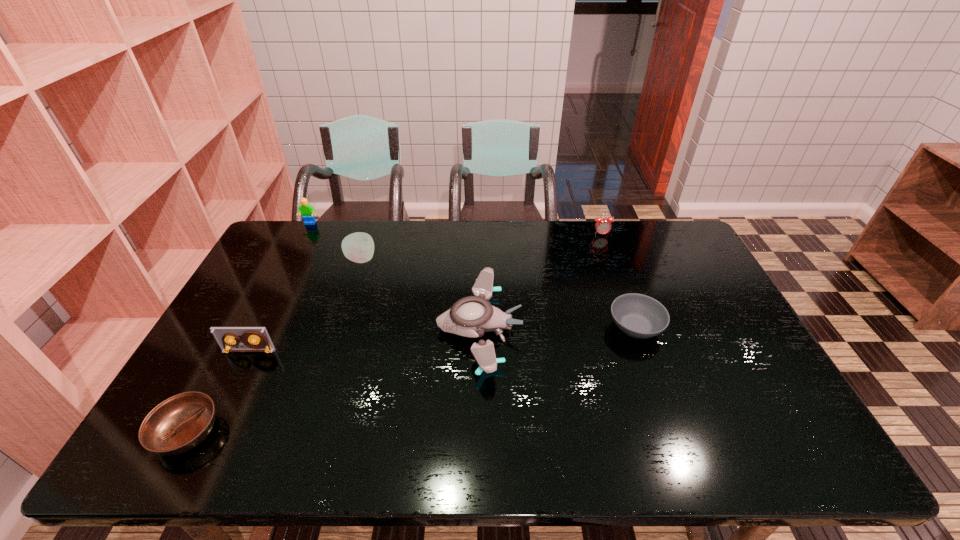
At what (x,y) coordinates should I click in order to perform the action: click on free point between the nearest object and the videotape. Please return your answer as a coordinate pair (x, y). The width and height of the screenshot is (960, 540). Looking at the image, I should click on (218, 392).

Where is `empty space that is in between the left soup bowl and the farther soup bowl`? This screenshot has height=540, width=960. empty space that is in between the left soup bowl and the farther soup bowl is located at coordinates pos(411,380).

The width and height of the screenshot is (960, 540). Identify the location of vacant space in between the second farthest object and the nearest object. (395, 333).

What are the coordinates of `vacant area between the videotape and the fourth object from left to right` in the screenshot? It's located at (305, 305).

The width and height of the screenshot is (960, 540). In order to click on empty space that is in between the videotape and the apple in this screenshot , I will do `click(305, 305)`.

I want to click on vacant space in between the shorter soup bowl and the videotape, so click(x=218, y=392).

Where is `object that stands as the fourth closest to the videotape`? This screenshot has height=540, width=960. object that stands as the fourth closest to the videotape is located at coordinates (308, 213).

Select which object is the fourth closest to the nearer soup bowl. Please provide its 2D coordinates. Your answer should be formatted as a tuple, i.e. [(x, y)], where the tuple contains the x and y coordinates of a point satisfying the conditions above.

[(308, 213)]

This screenshot has height=540, width=960. Identify the location of blank area in the image that satisfies the following two spatial constraints: 1. on the front-facing side of the drone; 2. at the front of the videotape with visible reels. (479, 351).

Find the location of a particular element. free location that satisfies the following two spatial constraints: 1. on the back side of the farther soup bowl; 2. on the left side of the left soup bowl is located at coordinates (244, 327).